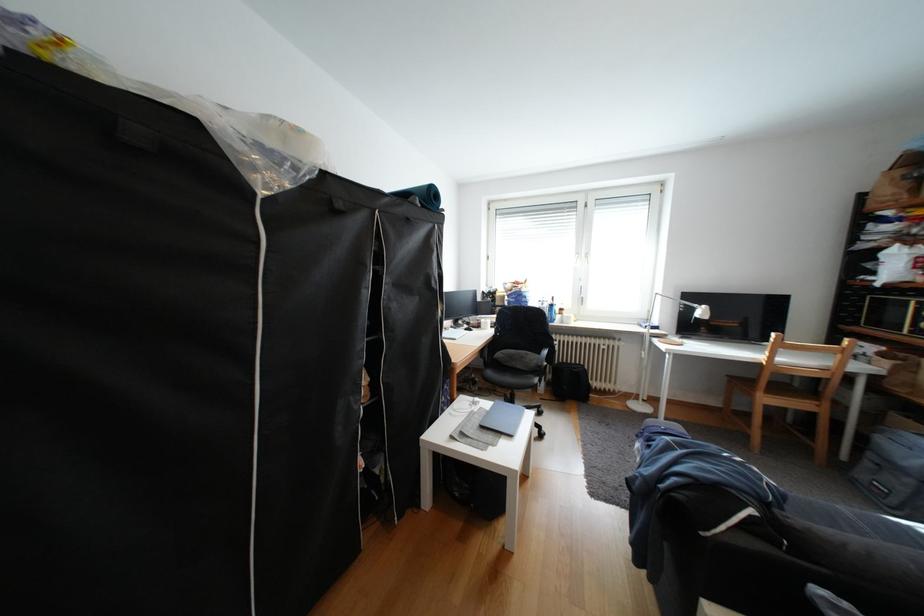
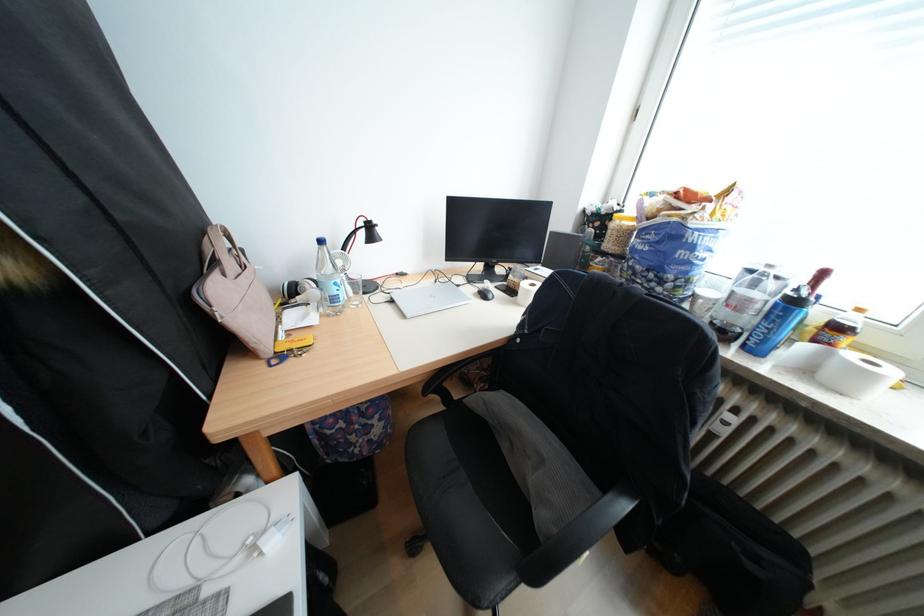
The point at (x=554, y=305) is marked in the first image. Where is the corresponding point in the second image?

(767, 285)